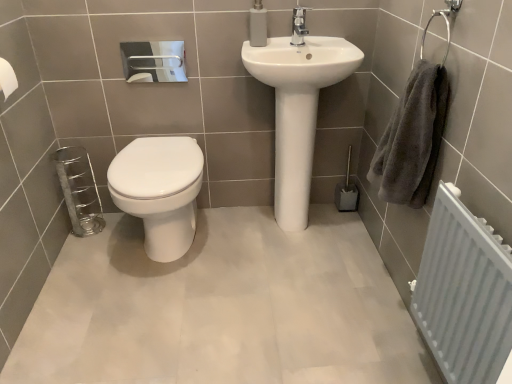
Identify the location of blank area beneath gray fluffy towel at right (from a real-world perspective). (372, 282).